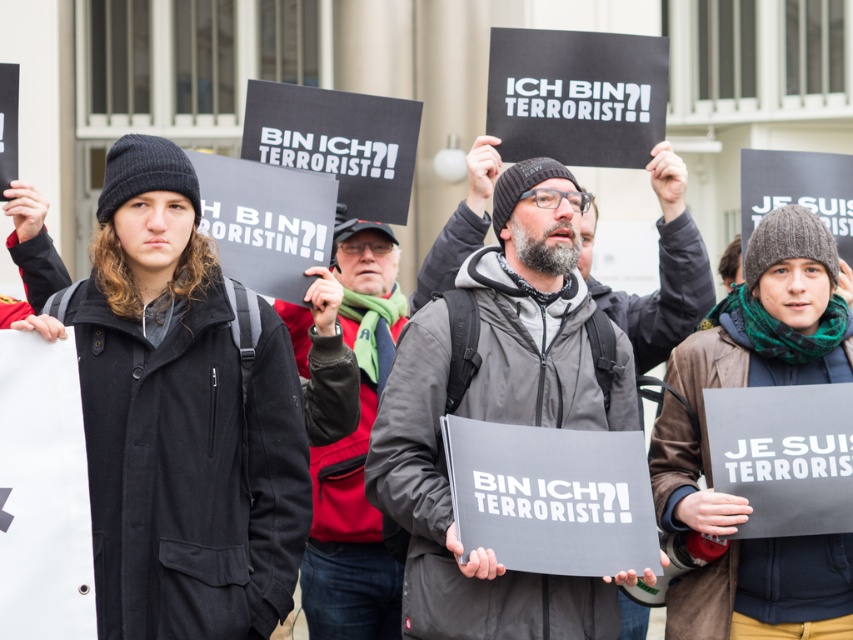
Can you confirm if gray fabric jacket at center is positioned to the left of matte black jacket at center?

In fact, gray fabric jacket at center is to the right of matte black jacket at center.

Between gray fabric jacket at center and matte black jacket at center, which one has less height?

gray fabric jacket at center

Image resolution: width=853 pixels, height=640 pixels. Identify the location of gray fabric jacket at center. (498, 417).

Locate an element on the screen. The image size is (853, 640). gray fabric jacket at center is located at coordinates (498, 417).